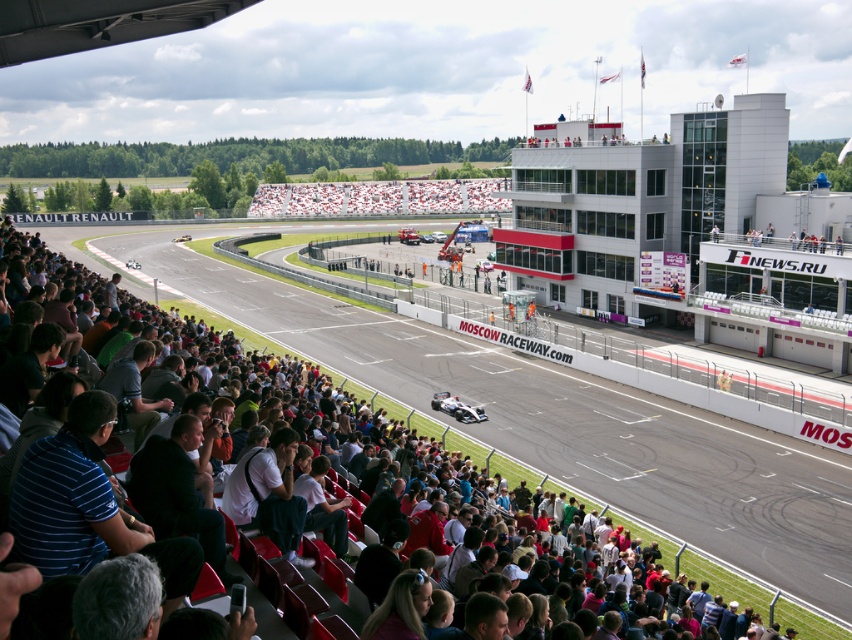
Between point (298, 381) and point (258, 518), which one is positioned behind?

The point (298, 381) is behind.

The width and height of the screenshot is (852, 640). In order to click on dark gray fabric seats at lower left in this screenshot , I will do `click(468, 513)`.

Does dark gray fabric seats at lower left have a greater width compared to white checkered seats at center?

In fact, dark gray fabric seats at lower left might be narrower than white checkered seats at center.

In the scene shown: Is dark gray fabric seats at lower left further to camera compared to white checkered seats at center?

No, dark gray fabric seats at lower left is closer to the viewer.

At what (x,y) coordinates should I click in order to perform the action: click on dark gray fabric seats at lower left. Please return your answer as a coordinate pair (x, y). Image resolution: width=852 pixels, height=640 pixels. Looking at the image, I should click on (468, 513).

Is white checkered seats at center to the left of white shirt at lower center from the viewer's perspective?

Indeed, white checkered seats at center is positioned on the left side of white shirt at lower center.

Who is positioned more to the right, white checkered seats at center or white shirt at lower center?

From the viewer's perspective, white shirt at lower center appears more on the right side.

Which is in front, point (314, 195) or point (240, 460)?

Point (240, 460)

I want to click on white checkered seats at center, so click(380, 196).